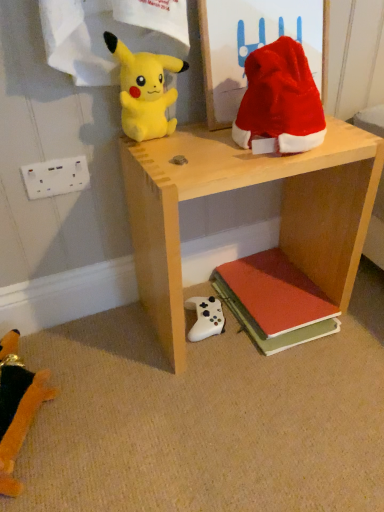
Image resolution: width=384 pixels, height=512 pixels. What are the coordinates of `free location to the left of velvet red santa hat at upper right, the first toy in the right-to-left sequence` in the screenshot? It's located at click(x=208, y=150).